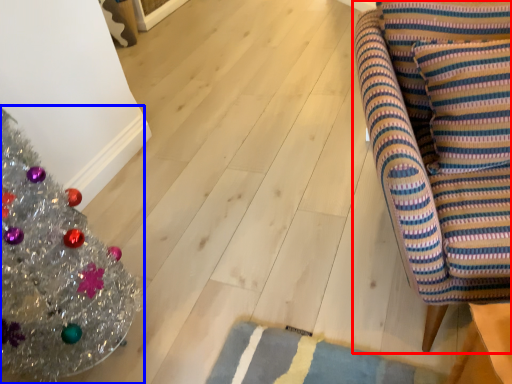
Question: Which object appears farthest to the camera in this image, furniture (highlighted by a red box) or christmas tree (highlighted by a blue box)?

Choices:
 (A) furniture
 (B) christmas tree

Answer: (A)